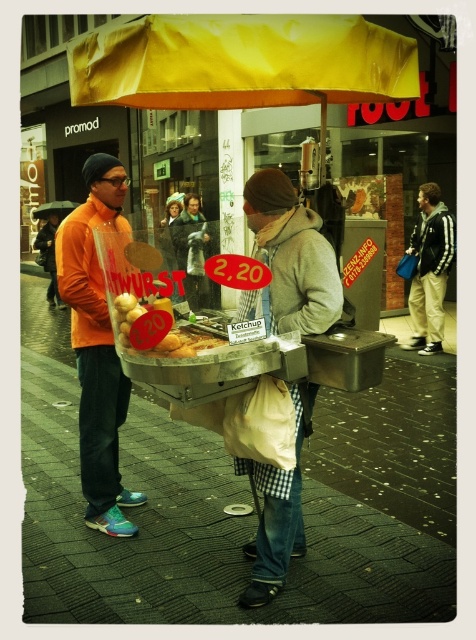
You are standing at the street corner and see the food stall with the yellow umbrella. There is a point marked at coordinates (241, 61). What object is located at this point?

The point at coordinates (241, 61) indicates the yellow fabric canopy at upper center.

You are a customer at the food stall and want to pick up the golden brown bread at center. However, there is a white fabric bag at center in the way. Can you reach the bread without moving the bag?

The white fabric bag at center is located above the golden brown bread at center, so you cannot reach the bread without moving the bag.